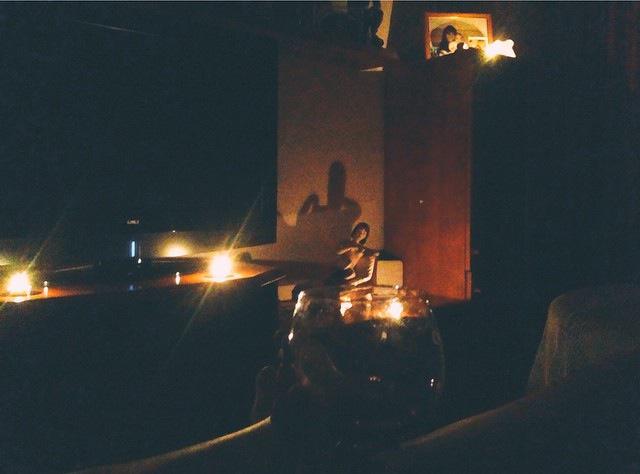
At what (x,y) coordinates should I click in order to perform the action: click on tall wooden cabinet. Please return your answer as a coordinate pair (x, y). Looking at the image, I should click on (429, 185).